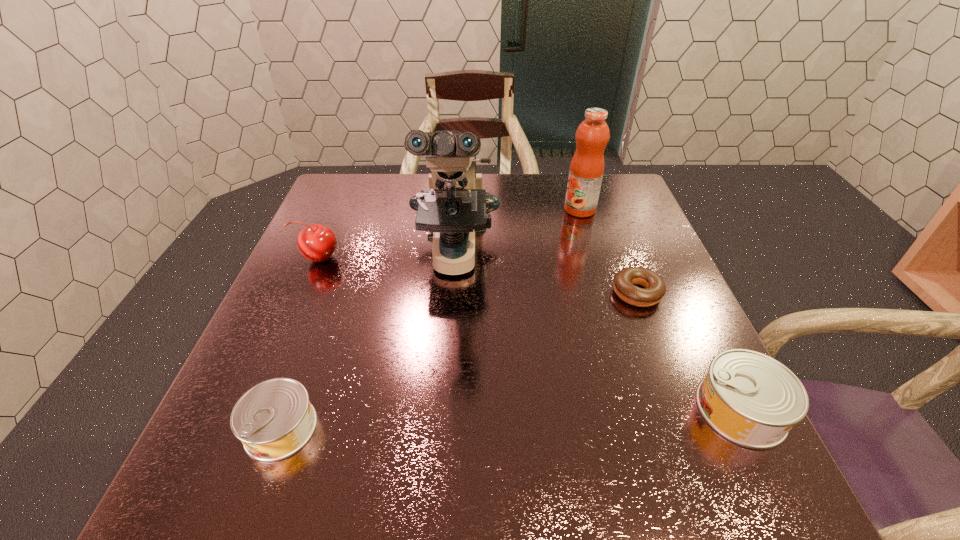
Locate an element on the screen. The width and height of the screenshot is (960, 540). vacant position for inserting another can evenly is located at coordinates (515, 418).